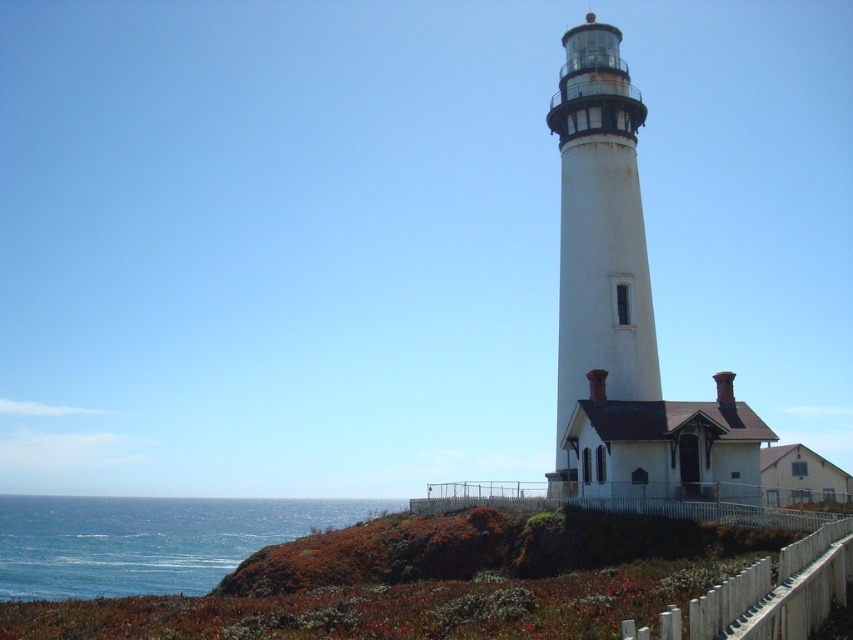
You are a bird soaring above the coastal hillside. You spot the white painted metal tower at center and the blue water at lower left. Which one appears taller from your perspective?

The white painted metal tower at center is much taller than the blue water at lower left, so it would appear taller from your perspective as a bird soaring above.

You are a bird flying over the coastal hillside. You see the white painted metal tower at center and the blue water at lower left. Which one is closer to your current position?

The blue water at lower left is closer to your current position because the white painted metal tower at center is positioned over it, meaning the tower is further away.

You are a painter wanting to capture the scene accurately. You notice the white painted metal tower at center and the blue water at lower left. Which object appears narrower in your painting?

The white painted metal tower at center appears narrower than the blue water at lower left.